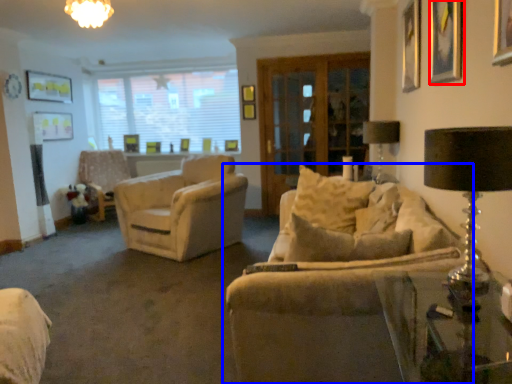
Question: Which object appears farthest to the camera in this image, picture frame (highlighted by a red box) or studio couch (highlighted by a blue box)?

Choices:
 (A) picture frame
 (B) studio couch

Answer: (A)